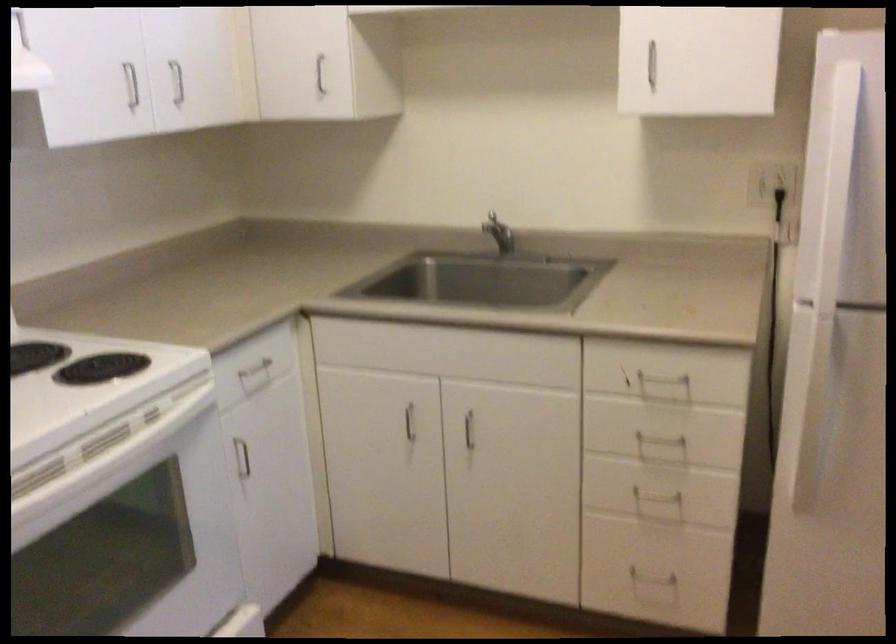
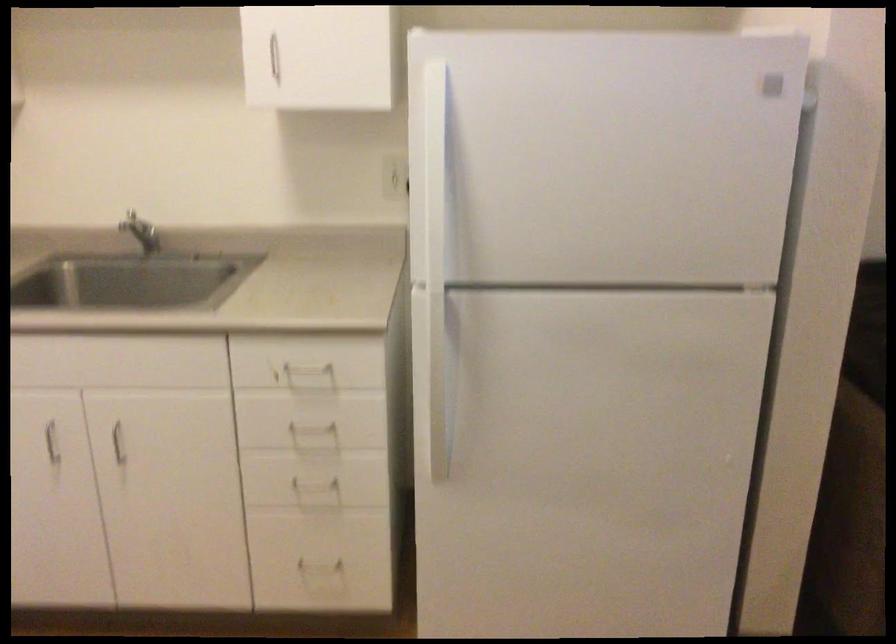
The point at (658,502) is marked in the first image. Where is the corresponding point in the second image?

(319, 486)